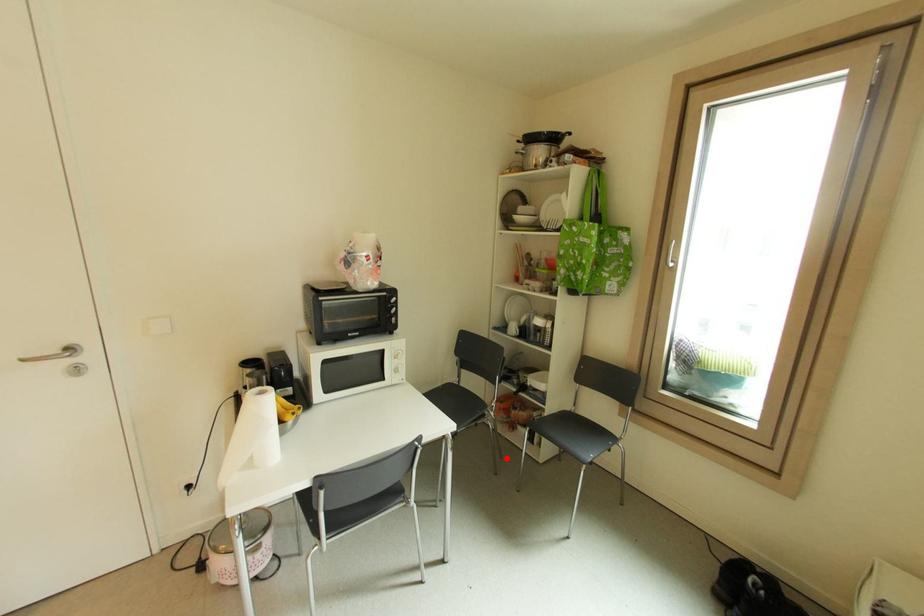
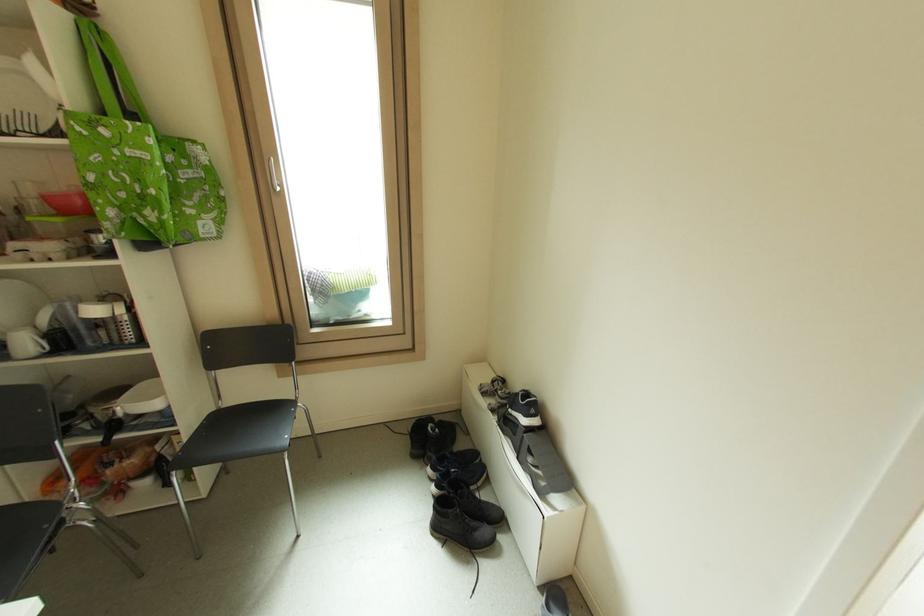
In the second image, find the point that corresponds to the highlighted location in the first image.

(141, 546)